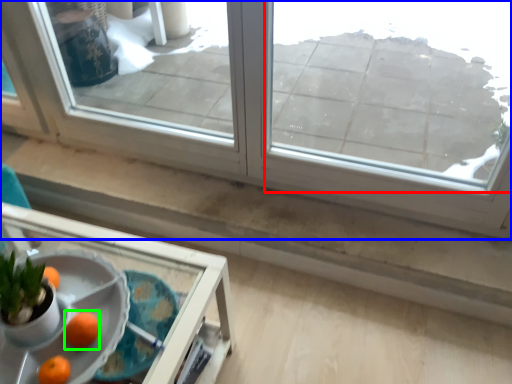
Question: Which object is positioned farthest from window (highlighted by a red box)? Select from window (highlighted by a blue box) and orange (highlighted by a green box).

Choices:
 (A) window
 (B) orange

Answer: (B)